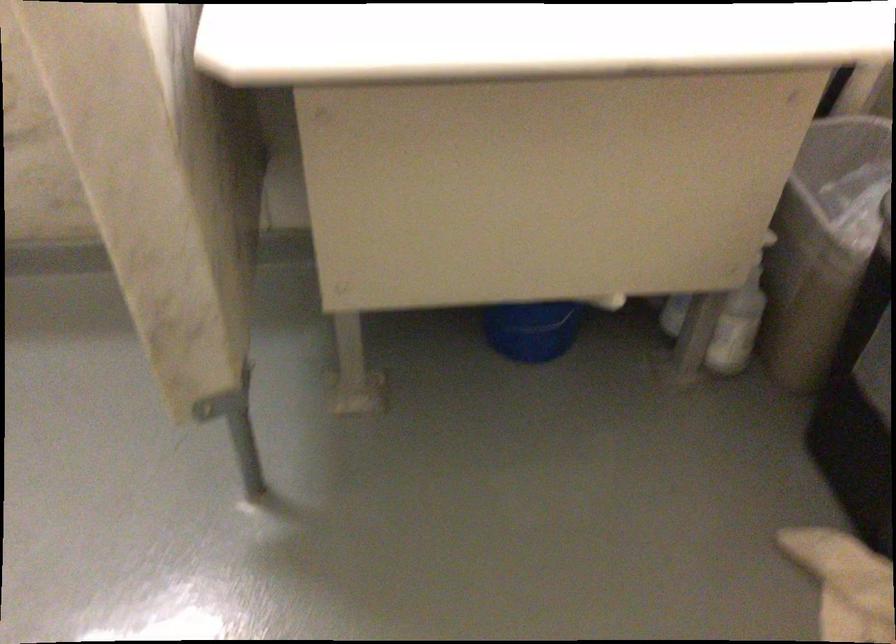
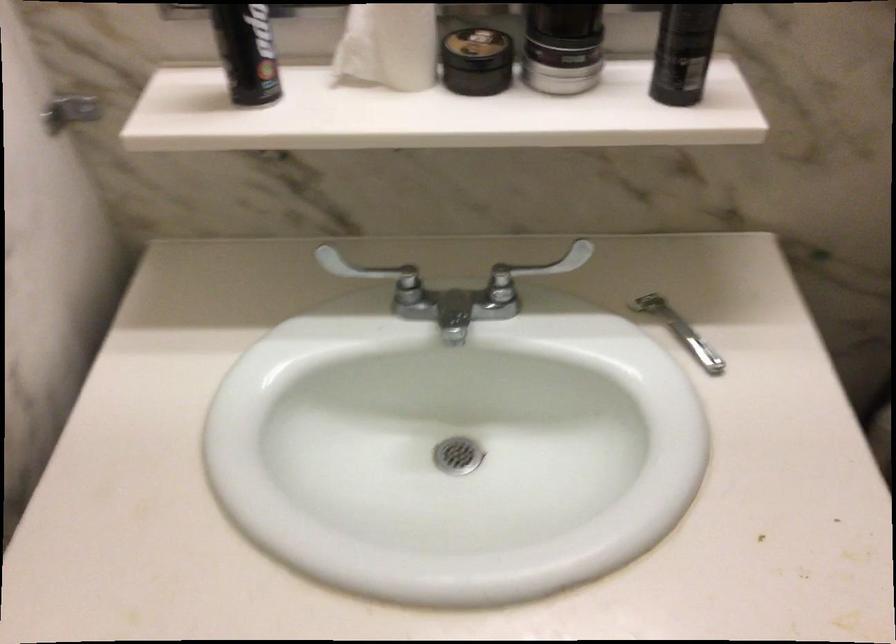
Question: How did the camera likely rotate?

Choices:
 (A) Left
 (B) Right
 (C) Up
 (D) Down

Answer: (A)